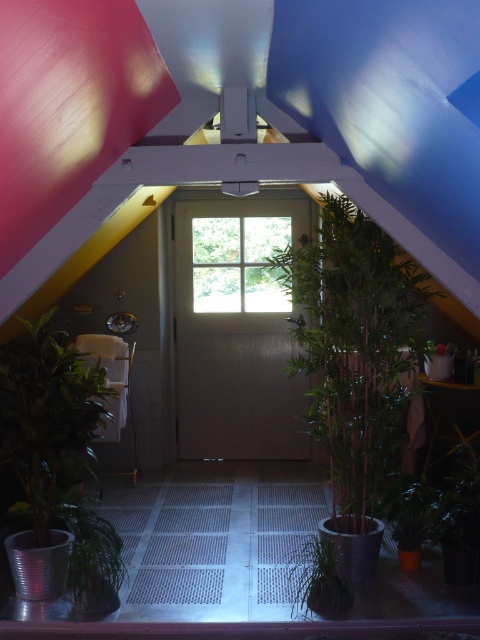
Question: Which point is farther from the camera taking this photo?

Choices:
 (A) (256, 262)
 (B) (310, 596)
 (C) (391, 392)
 (D) (80, 397)

Answer: (A)

Question: Can you confirm if green bamboo at center is wider than green leafy plant at left?

Choices:
 (A) no
 (B) yes

Answer: (B)

Question: Does clear glass window at center lie behind green matte plant at center?

Choices:
 (A) yes
 (B) no

Answer: (A)

Question: Which point is closer to the camera taking this photo?

Choices:
 (A) (48, 490)
 (B) (312, 604)
 (C) (312, 250)

Answer: (B)

Question: Which point is closer to the camera taking this photo?

Choices:
 (A) (211, 252)
 (B) (385, 266)
 (C) (23, 566)
 (D) (305, 573)

Answer: (C)

Question: Is clear glass window at center thinner than green matte plant at center?

Choices:
 (A) yes
 (B) no

Answer: (B)